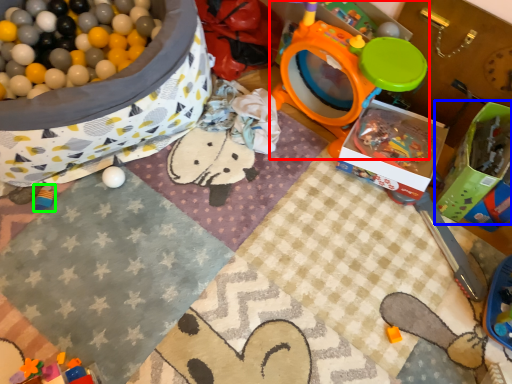
Question: Considering the real-world distances, which object is closest to toy (highlighted by a red box)? box (highlighted by a blue box) or toy (highlighted by a green box).

Choices:
 (A) box
 (B) toy

Answer: (A)